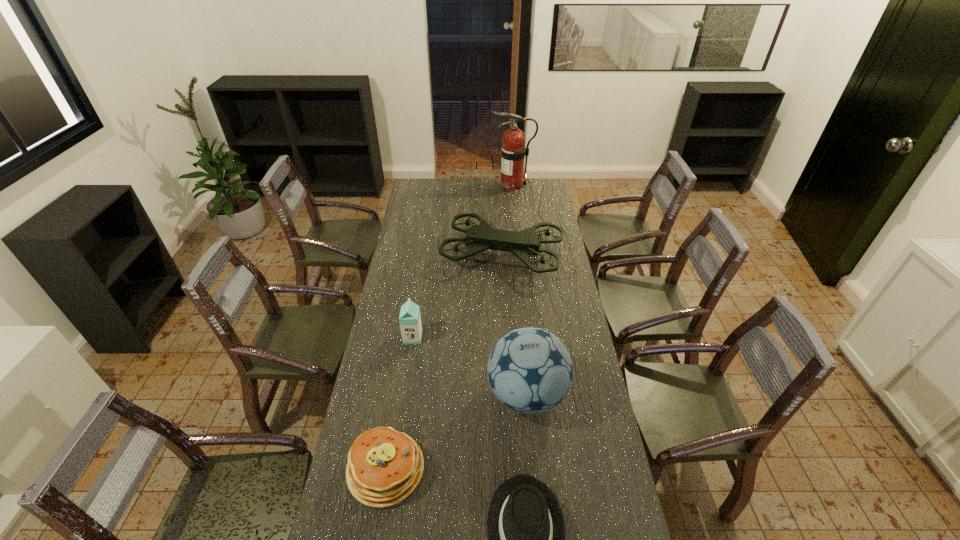
Where is `free point located on the front of the drone`? This screenshot has height=540, width=960. free point located on the front of the drone is located at coordinates (507, 325).

The width and height of the screenshot is (960, 540). In order to click on vacant space located 0.360m on the side with brand of the fourth farthest object in this screenshot , I will do `click(384, 395)`.

In order to click on vacant space situated 0.310m on the side with brand of the fourth farthest object in this screenshot , I will do `click(398, 395)`.

In order to click on free region located 0.130m on the side with brand of the fourth farthest object in this screenshot , I will do point(449,395).

Locate an element on the screen. The height and width of the screenshot is (540, 960). free spot located on the front of the fourth nearest object is located at coordinates (404, 392).

The height and width of the screenshot is (540, 960). In order to click on free spot located 0.060m on the right of the pancake in this screenshot , I will do `click(444, 469)`.

Locate an element on the screen. The height and width of the screenshot is (540, 960). object situated at the far edge is located at coordinates (513, 151).

Locate an element on the screen. The image size is (960, 540). milk carton present at the left edge is located at coordinates (410, 319).

Where is `pancake that is at the left edge`? The width and height of the screenshot is (960, 540). pancake that is at the left edge is located at coordinates (384, 466).

Where is `fire extinguisher that is at the right edge`? This screenshot has height=540, width=960. fire extinguisher that is at the right edge is located at coordinates (513, 151).